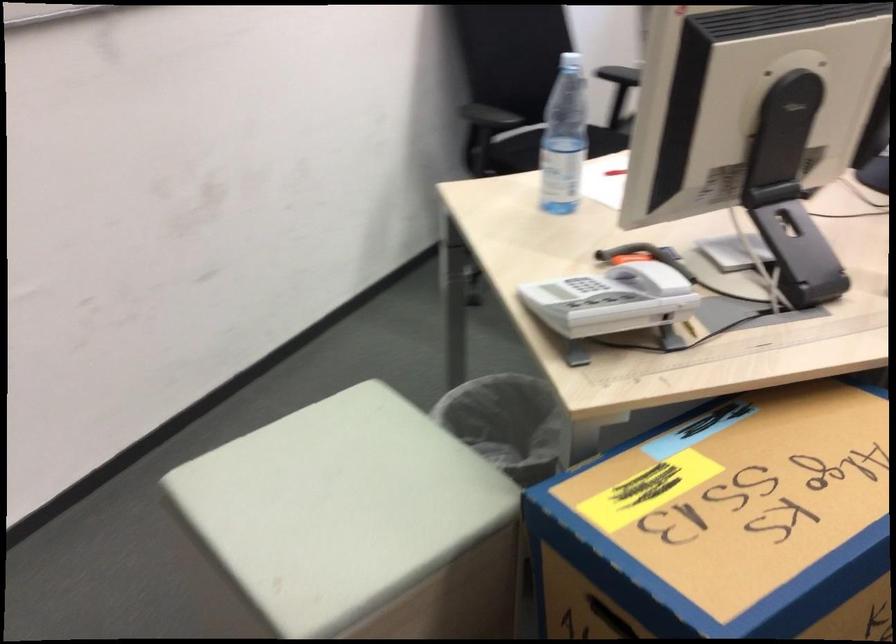
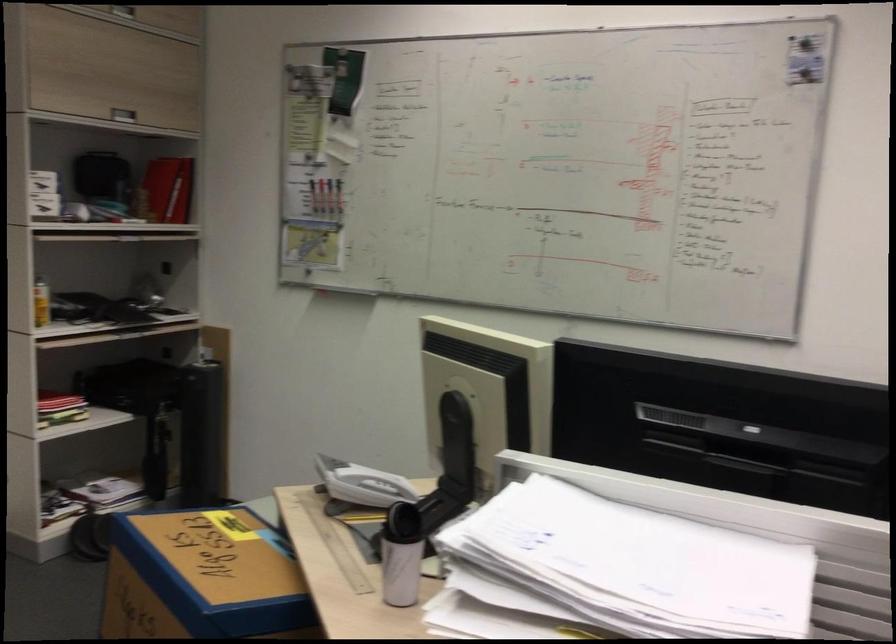
Question: I am providing you with two images of the same scene from different viewpoints. Which of the following objects are not visible in image2?

Choices:
 (A) whiteboard marker
 (B) chalkboard eraser
 (C) padded stool surface
 (D) black storage case

Answer: (C)